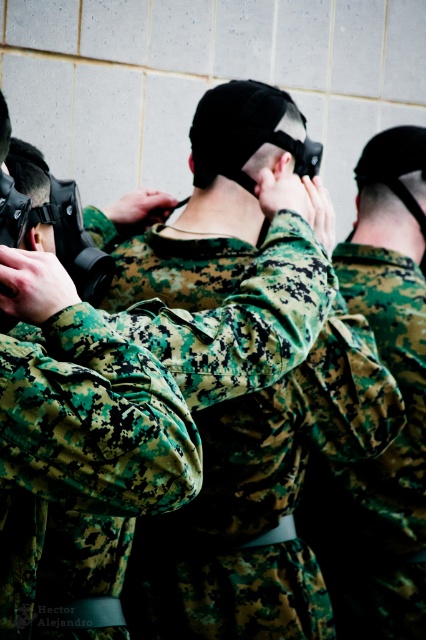
You are a photographer positioned in front of the group of individuals in the scene. You need to determine which of the two points, point (x=331, y=456) or point (x=348, y=237), is closer to you. Which one is closer?

Point (x=331, y=456) is closer to the viewer than point (x=348, y=237).

You are an observer in the scene. You see two camouflage fabrics. The camouflage fabric uniform at center and the camouflage fabric at center. Which one is on the left side?

The camouflage fabric uniform at center is to the left of camouflage fabric at center.

Where is the camouflage fabric uniform at center located in the image?

The camouflage fabric uniform at center is located at point (261, 499) in the image.